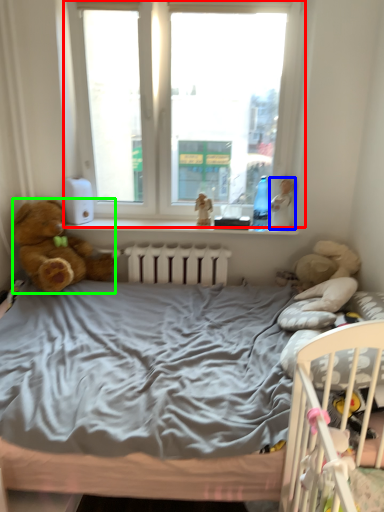
Question: Considering the real-world distances, which object is farthest from window (highlighted by a red box)? doll (highlighted by a blue box) or teddy bear (highlighted by a green box)?

Choices:
 (A) doll
 (B) teddy bear

Answer: (B)